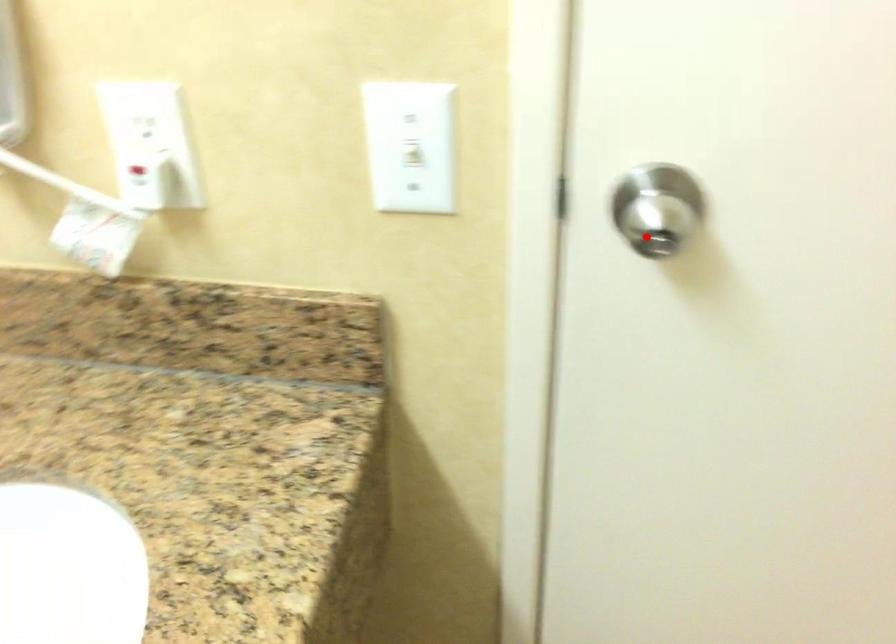
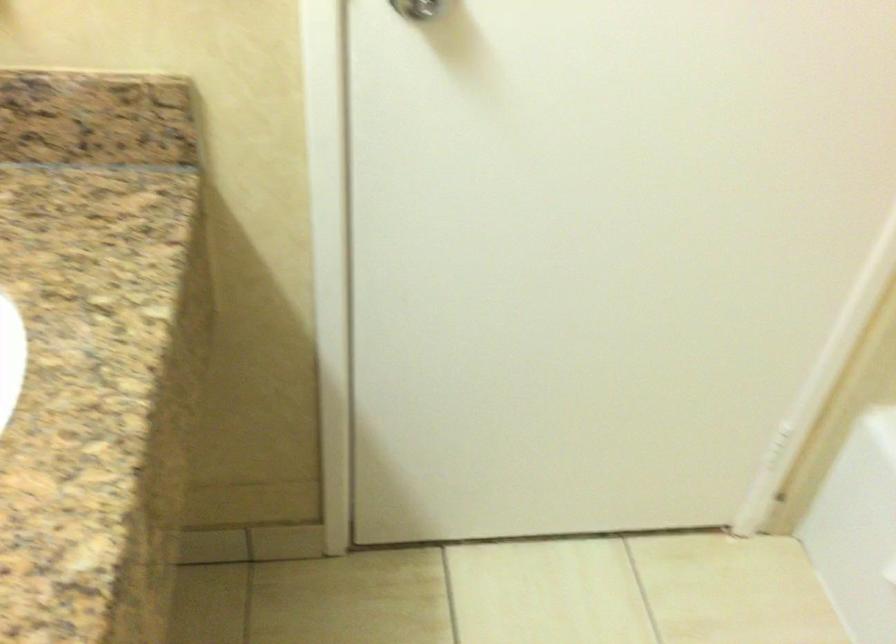
Where in the second image is the point corresponding to the highlighted location from the first image?

(417, 8)